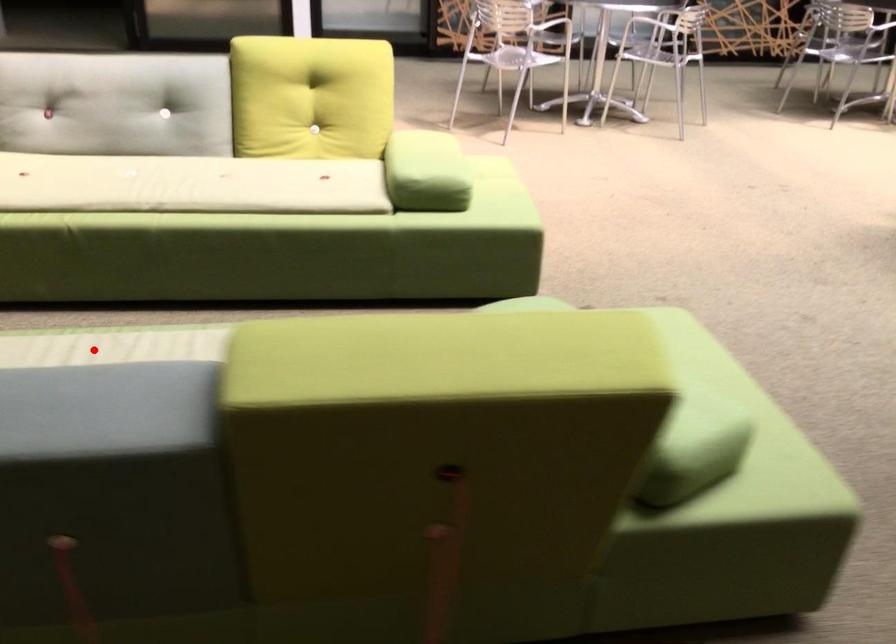
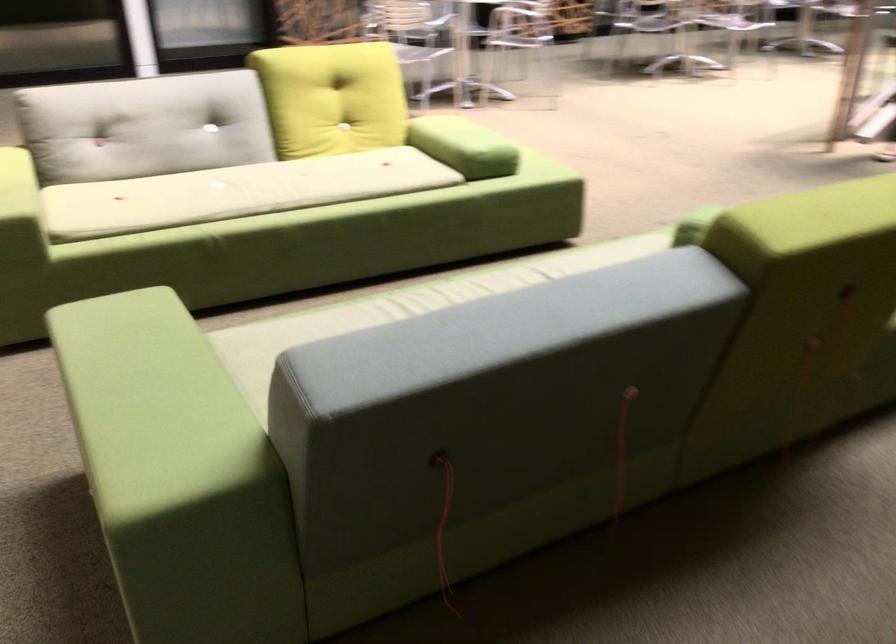
Question: I am providing you with two images of the same scene from different viewpoints. Given a red point in image1, look at the same physical point in image2. Is it:

Choices:
 (A) Closer to the viewpoint
 (B) Farther from the viewpoint

Answer: (B)